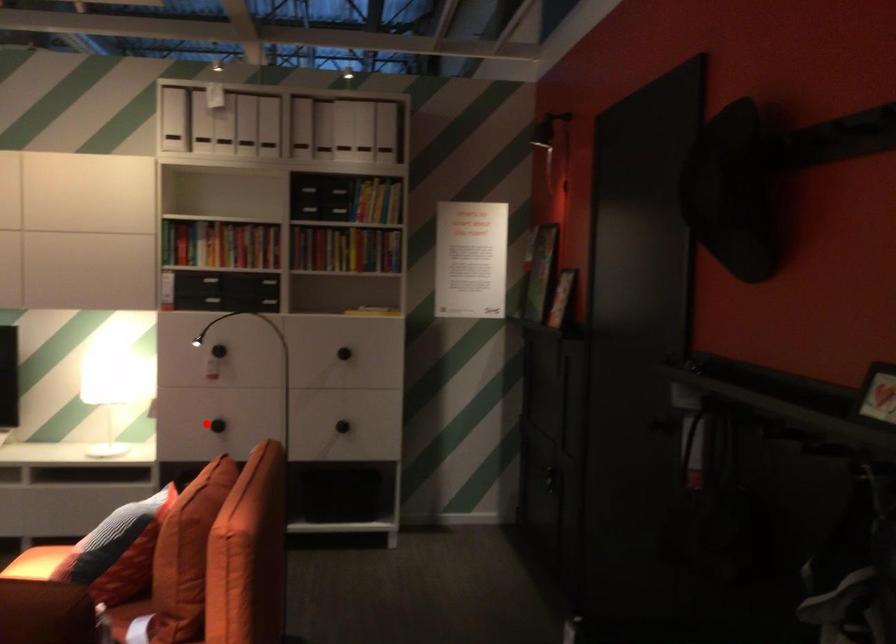
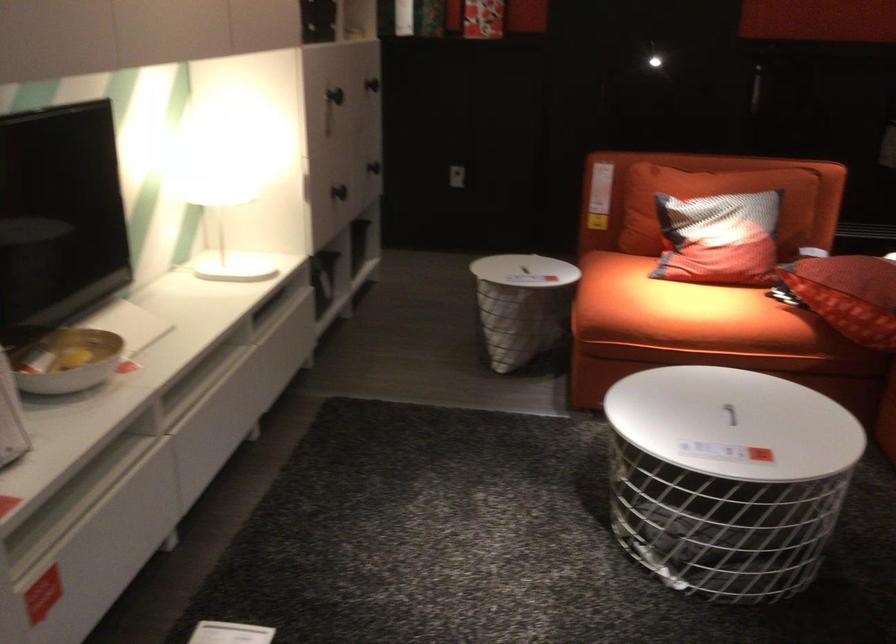
Question: I am providing you with two images of the same scene from different viewpoints. A red point is marked on the first image. Can you still see the location of the red point in image 2?

Choices:
 (A) Yes
 (B) No

Answer: (A)